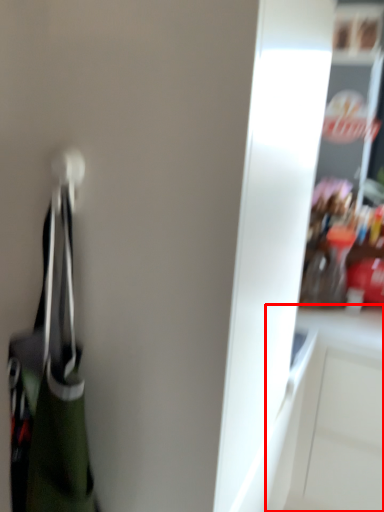
Question: From the image's perspective, what is the correct spatial positioning of cabinetry (annotated by the red box) in reference to handbag?

Choices:
 (A) below
 (B) above

Answer: (A)